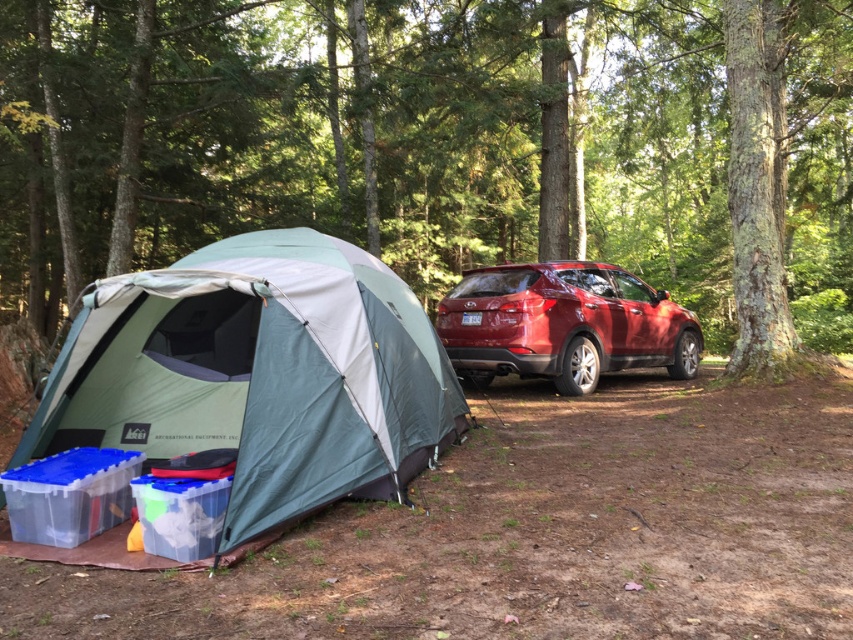
Question: Can you confirm if green textured tree at center is positioned below shiny red suv at center?

Choices:
 (A) no
 (B) yes

Answer: (A)

Question: Among these objects, which one is farthest from the camera?

Choices:
 (A) green fabric tent at left
 (B) green textured tree at center
 (C) shiny red suv at center

Answer: (C)

Question: Estimate the real-world distances between objects in this image. Which object is closer to the shiny red suv at center?

Choices:
 (A) green textured tree at center
 (B) green fabric tent at left

Answer: (B)

Question: Is green textured tree at center to the right of green fabric tent at left from the viewer's perspective?

Choices:
 (A) no
 (B) yes

Answer: (B)

Question: Which object is the farthest from the green textured tree at center?

Choices:
 (A) green fabric tent at left
 (B) shiny red suv at center

Answer: (A)

Question: In this image, where is green fabric tent at left located relative to shiny red suv at center?

Choices:
 (A) left
 (B) right

Answer: (A)